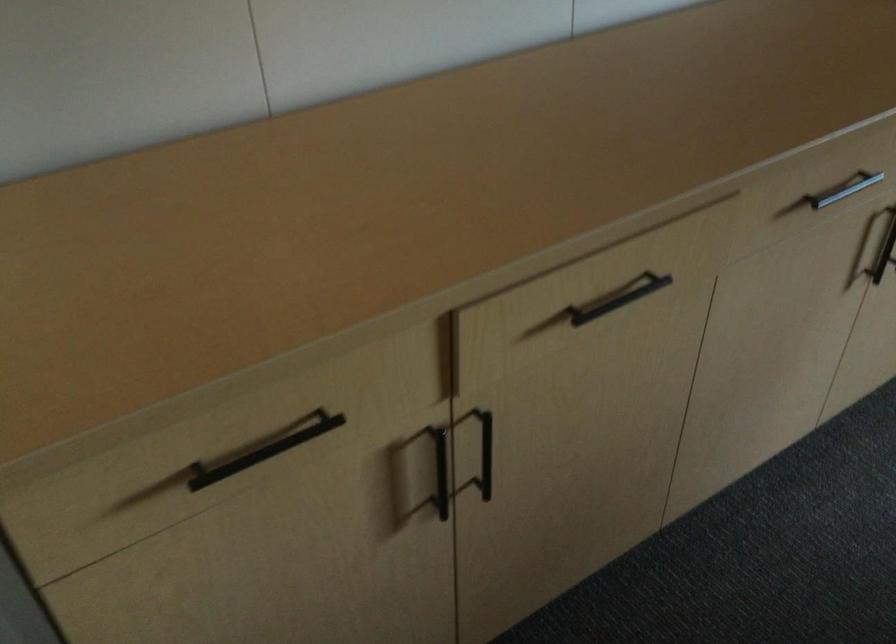
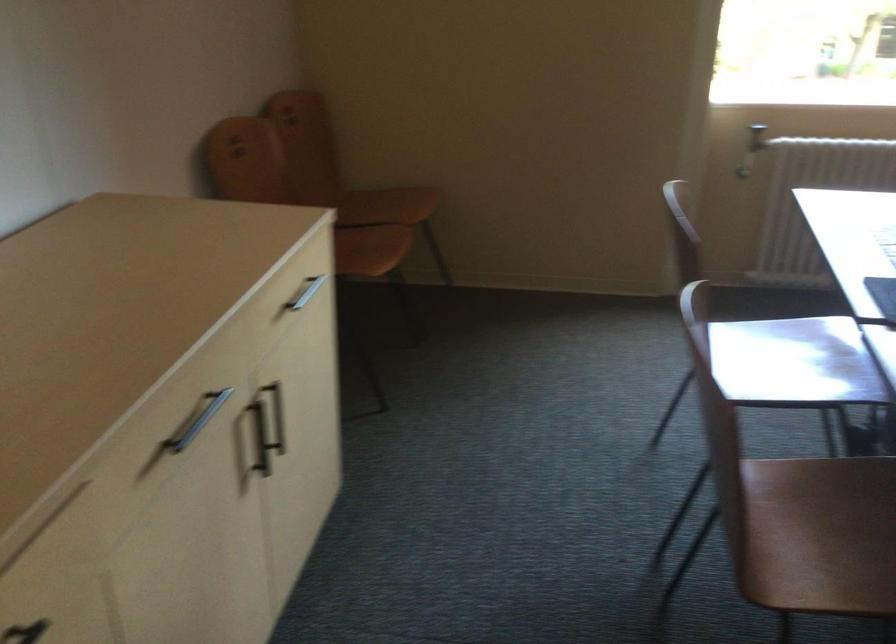
Question: The images are taken continuously from a first-person perspective. In which direction is your viewpoint rotating?

Choices:
 (A) Left
 (B) Right
 (C) Up
 (D) Down

Answer: (B)